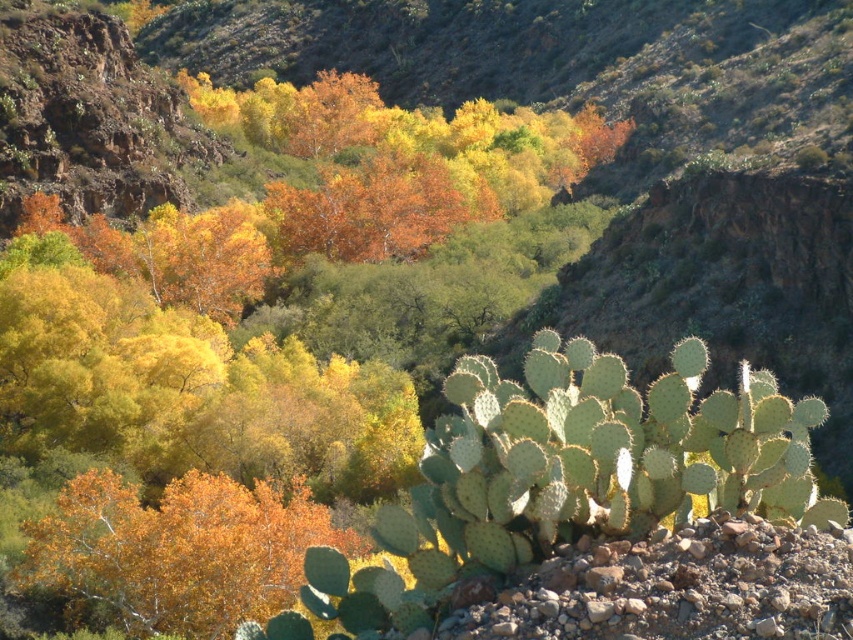
Consider the image. You are standing in the desert and see the golden textured leaves at center and the green spiny cactus at lower right. Which object is positioned further to the right?

The green spiny cactus at lower right is positioned further to the right than the golden textured leaves at center.